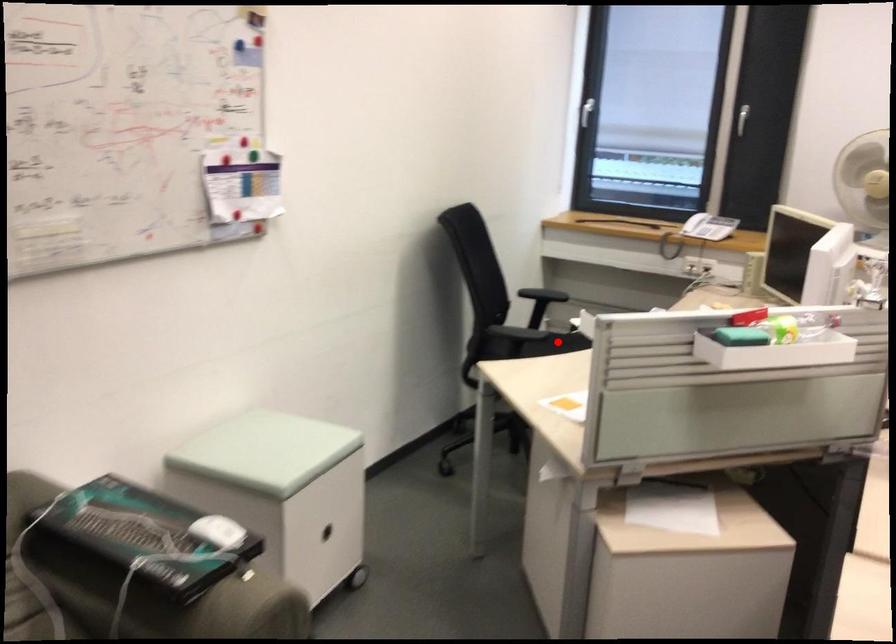
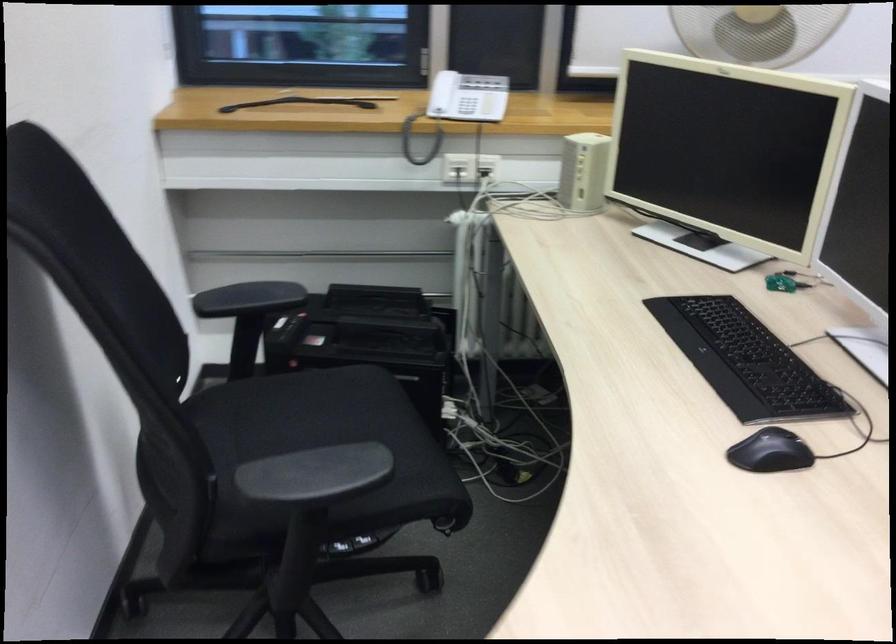
Question: I am providing you with two images of the same scene from different viewpoints. In image1, a red point is highlighted. Considering the same 3D point in image2, which of the following is correct?

Choices:
 (A) It is closer
 (B) It is farther

Answer: (A)